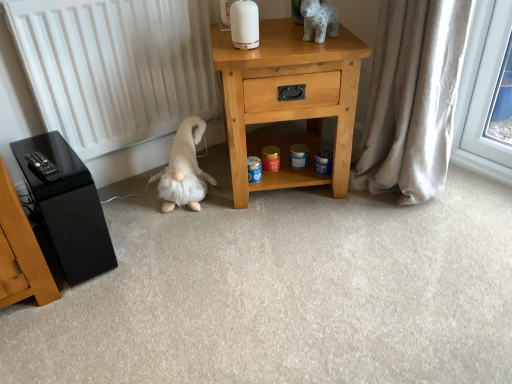
You are a GUI agent. You are given a task and a screenshot of the screen. Output one action in this format:
    pyautogui.click(x=<x>, y=<y>)
    Task: Click on the free space to the right of beige fabric curtain at right
    
    Given the screenshot: What is the action you would take?
    pyautogui.click(x=467, y=195)